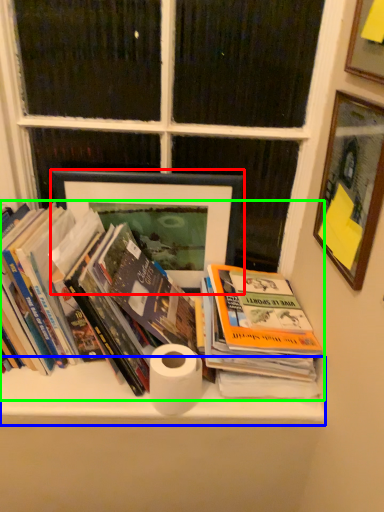
Question: Which object is the closest to the picture frame (highlighted by a red box)? Choose among these: shelf (highlighted by a blue box) or book (highlighted by a green box).

Choices:
 (A) shelf
 (B) book

Answer: (B)